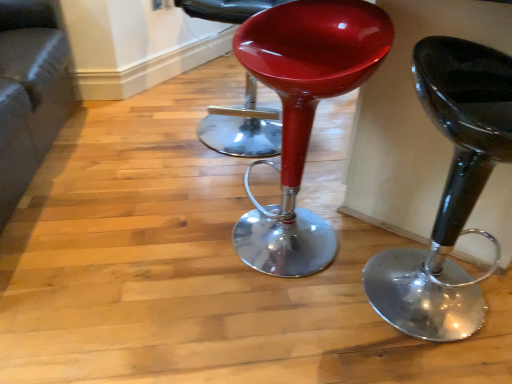
Find the location of a particular element. vacant region in front of glossy plastic stool at center, which is counted as the 1th stool, starting from the left is located at coordinates (266, 335).